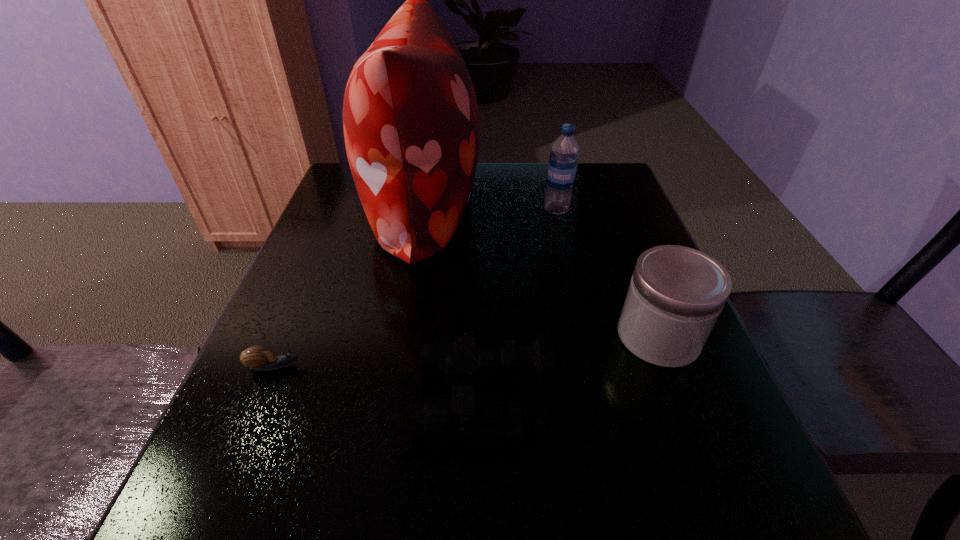
What are the coordinates of `vacant area between the third tallest object and the tallest object` in the screenshot? It's located at (540, 272).

Where is `empty space that is in between the binoculars and the rightmost object`? This screenshot has height=540, width=960. empty space that is in between the binoculars and the rightmost object is located at coordinates (570, 368).

This screenshot has width=960, height=540. I want to click on empty location between the second object from right to left and the jar, so click(608, 273).

At what (x,y) coordinates should I click in order to perform the action: click on free spot between the tallest object and the fourth shortest object. Please return your answer as a coordinate pair (x, y). This screenshot has width=960, height=540. Looking at the image, I should click on (490, 209).

The image size is (960, 540). In order to click on free spot between the binoculars and the leftmost object in this screenshot , I will do point(379,383).

Where is `vacant area that lies between the cushion and the leftmost object`? The width and height of the screenshot is (960, 540). vacant area that lies between the cushion and the leftmost object is located at coordinates (349, 287).

Locate an element on the screen. The width and height of the screenshot is (960, 540). free area in between the third tallest object and the cushion is located at coordinates (540, 272).

Locate an element on the screen. The image size is (960, 540). object that is the closest one to the cushion is located at coordinates (563, 160).

Locate an element on the screen. Image resolution: width=960 pixels, height=540 pixels. object that is the third closest to the third tallest object is located at coordinates (563, 160).

Find the location of a particular element. This screenshot has width=960, height=540. free space that satisfies the following two spatial constraints: 1. on the front-facing side of the cushion; 2. on the back side of the rightmost object is located at coordinates (400, 336).